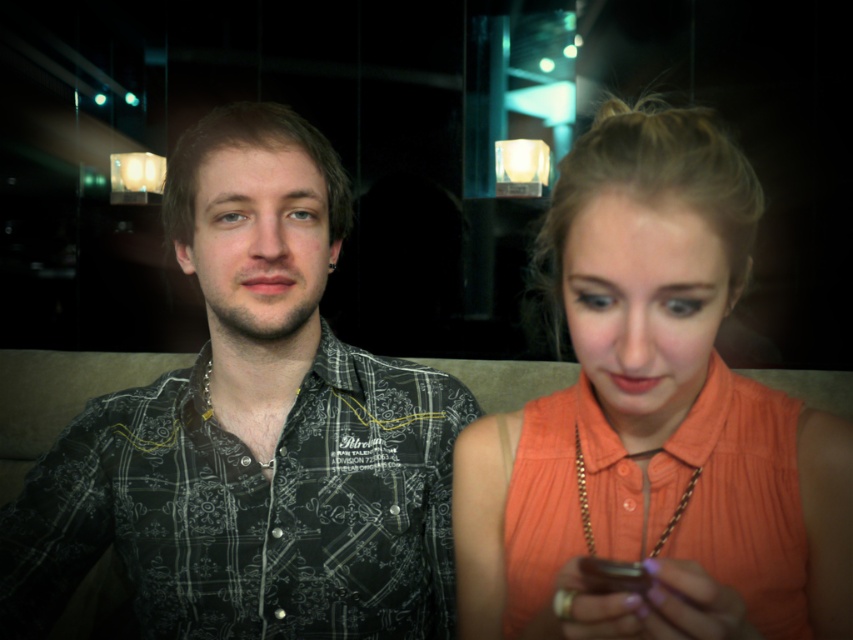
You are standing in the room and want to locate the patterned shirt at left. Which direction should you look relative to the point marked at coordinate [252,433]?

The patterned shirt at left is represented by the point at coordinate [252,433], so you should look directly at that point to locate it.

You are standing in the room and want to locate the orange fabric shirt at center. According to the coordinates given, where would you look to find it?

The orange fabric shirt at center is located at coordinates point (x=654, y=419).